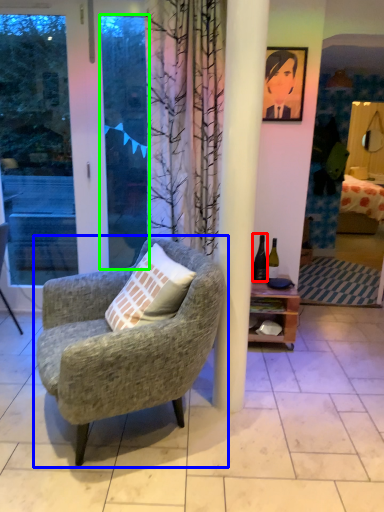
Question: Which is nearer to the bottle (highlighted by a red box)? chair (highlighted by a blue box) or window screen (highlighted by a green box).

Choices:
 (A) chair
 (B) window screen

Answer: (B)